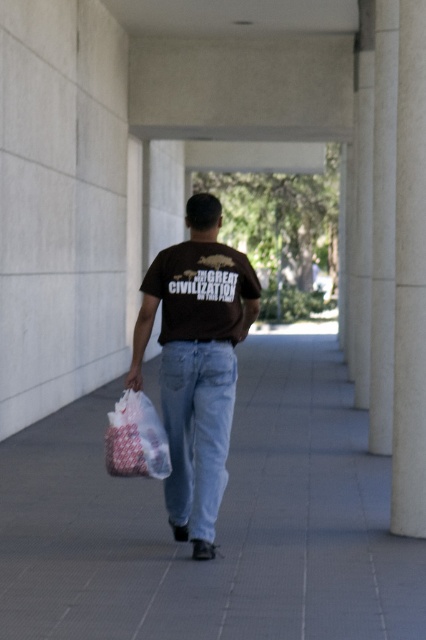
Question: Which of the following is the farthest from the observer?

Choices:
 (A) (256, 618)
 (B) (402, 209)
 (C) (216, 269)
 (D) (184, 256)

Answer: (B)

Question: Which point is closer to the camera?

Choices:
 (A) (118, 396)
 (B) (252, 282)
 (C) (150, 413)
 (D) (416, 189)

Answer: (C)

Question: Can you confirm if gray concrete pavement at center is positioned to the left of brown cotton t-shirt at center?

Choices:
 (A) no
 (B) yes

Answer: (B)

Question: Which object appears farthest from the camera in this image?

Choices:
 (A) plastic bag at lower center
 (B) matte brown t-shirt at center
 (C) gray concrete pavement at center
 (D) white smooth pillar at right

Answer: (D)

Question: Can you confirm if gray concrete pavement at center is positioned to the left of white smooth pillar at right?

Choices:
 (A) no
 (B) yes

Answer: (B)

Question: Does matte brown t-shirt at center have a lesser width compared to plastic bag at lower center?

Choices:
 (A) yes
 (B) no

Answer: (B)